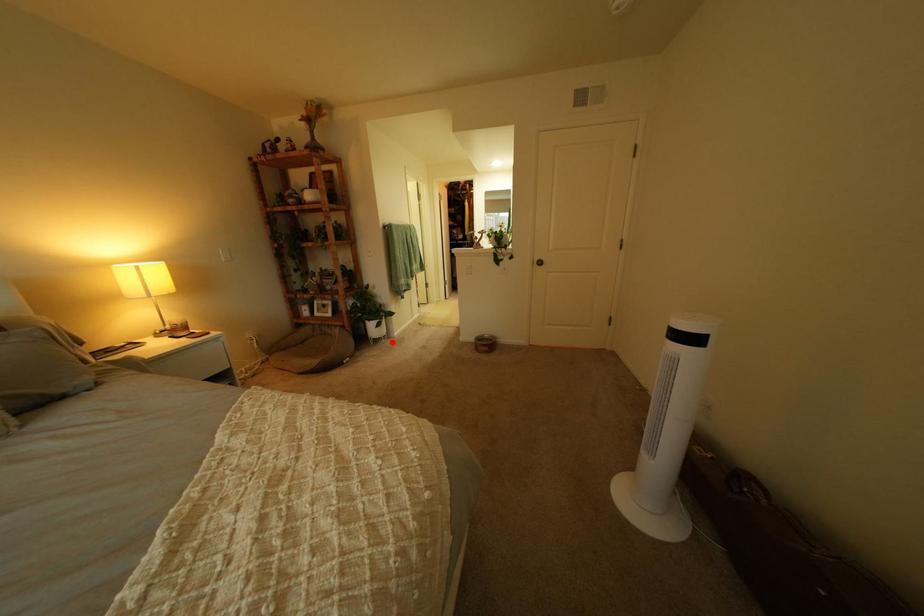
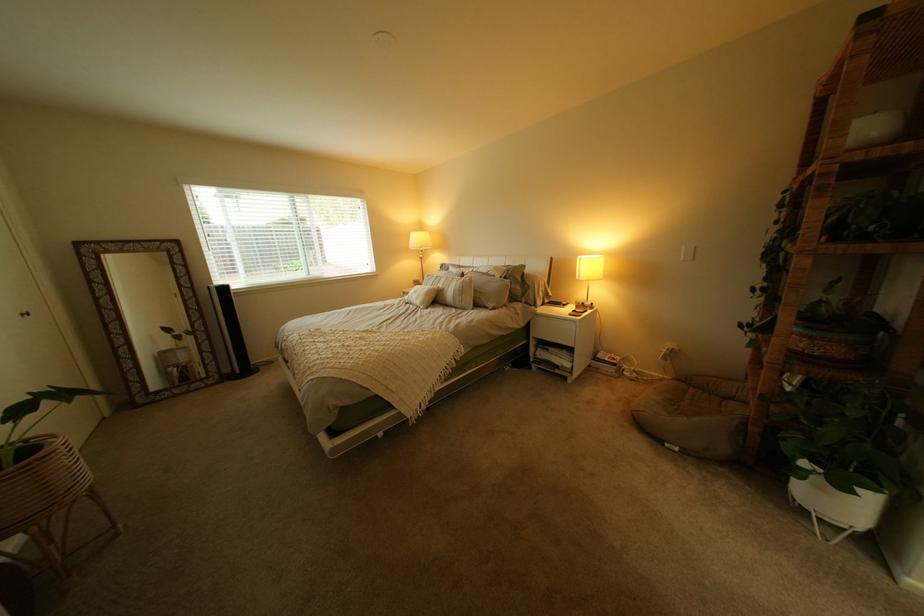
Find the pixel in the second image that matches the highlighted location in the first image.

(821, 512)